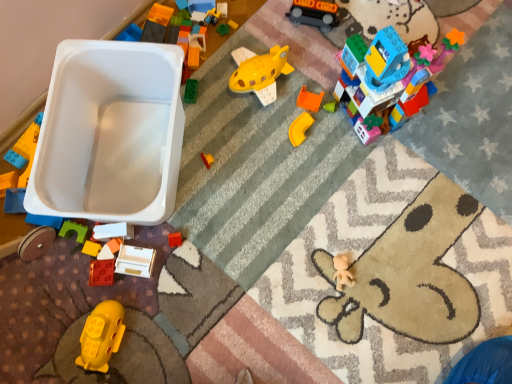
Find the location of a particular element. free space between yellow matte toy submarine at lower left, which is the first toy from bottom to top, and multicolored plastic building block at upper right, which appears as the seventh toy when ordered from the bottom is located at coordinates (254, 208).